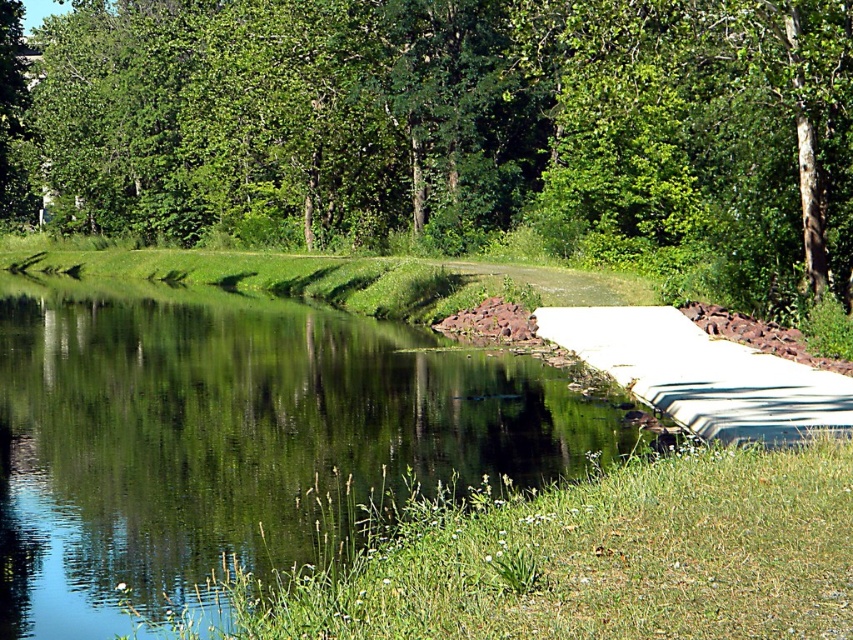
The width and height of the screenshot is (853, 640). What are the coordinates of `green leafy tree at upper center` in the screenshot? It's located at (461, 125).

Which is behind, point (843, 70) or point (813, 412)?

The point (843, 70) is behind.

This screenshot has width=853, height=640. Identify the location of green leafy tree at upper center. (461, 125).

Which is more to the left, clear water at center or white smooth concrete at right?

Positioned to the left is clear water at center.

Which is in front, point (270, 548) or point (650, 332)?

Point (270, 548)

Is point (32, 412) closer to camera compared to point (668, 406)?

No, (32, 412) is further to viewer.

The image size is (853, 640). I want to click on clear water at center, so click(233, 436).

In the scene shown: Which of these two, green leafy tree at upper center or clear water at center, stands taller?

With more height is green leafy tree at upper center.

What do you see at coordinates (461, 125) in the screenshot? The height and width of the screenshot is (640, 853). I see `green leafy tree at upper center` at bounding box center [461, 125].

Identify the location of green leafy tree at upper center. (461, 125).